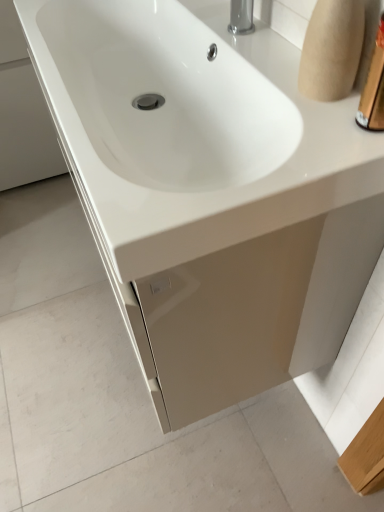
Question: Considering the positions of point (81, 83) and point (375, 119), is point (81, 83) closer or farther from the camera than point (375, 119)?

Choices:
 (A) closer
 (B) farther

Answer: (B)

Question: From the image's perspective, relative to gold metallic container at upper right, is white glossy sink at center above or below?

Choices:
 (A) above
 (B) below

Answer: (A)

Question: Considering their positions, is white glossy sink at center located in front of or behind gold metallic container at upper right?

Choices:
 (A) behind
 (B) front

Answer: (A)

Question: Which is correct: gold metallic container at upper right is inside white glossy sink at center, or outside of it?

Choices:
 (A) inside
 (B) outside

Answer: (B)

Question: In terms of height, does gold metallic container at upper right look taller or shorter compared to white glossy sink at center?

Choices:
 (A) tall
 (B) short

Answer: (A)

Question: Considering the positions of point (380, 17) and point (175, 15), is point (380, 17) closer or farther from the camera than point (175, 15)?

Choices:
 (A) farther
 (B) closer

Answer: (B)

Question: In the image, is gold metallic container at upper right on the left side or the right side of white glossy sink at center?

Choices:
 (A) right
 (B) left

Answer: (A)